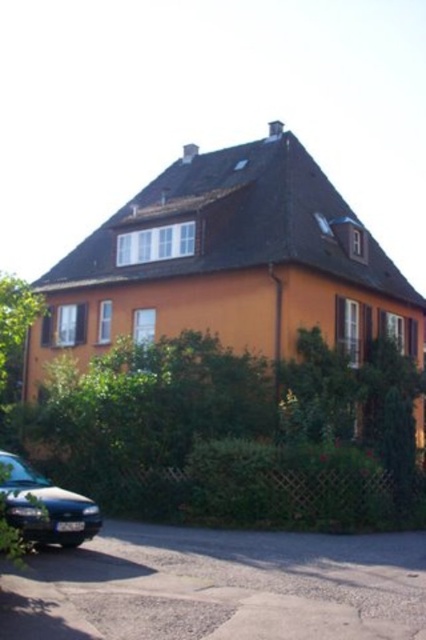
You are standing in front of the residential building and want to know the exact position of the green leafy hedge at center. What are its coordinates?

The green leafy hedge at center is located at coordinates (230, 435).